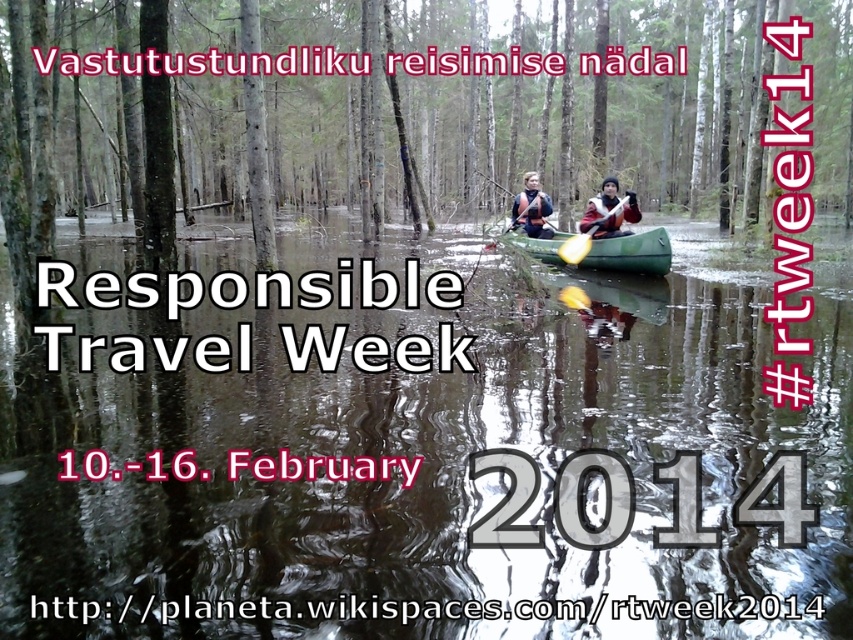
You are observing a forest scene with a green canoe on a reflective waterway. There are two points marked in the image. The first point is at coordinates point (659, 240) and the second point is at point (577, 252). Which point is closer to you?

Point (659, 240) is closer to the camera than point (577, 252).

You are packing for a trip and have a brown fur coat at center and a matte black kayak at center. Which item is wider?

The brown fur coat at center is wider than the matte black kayak at center.